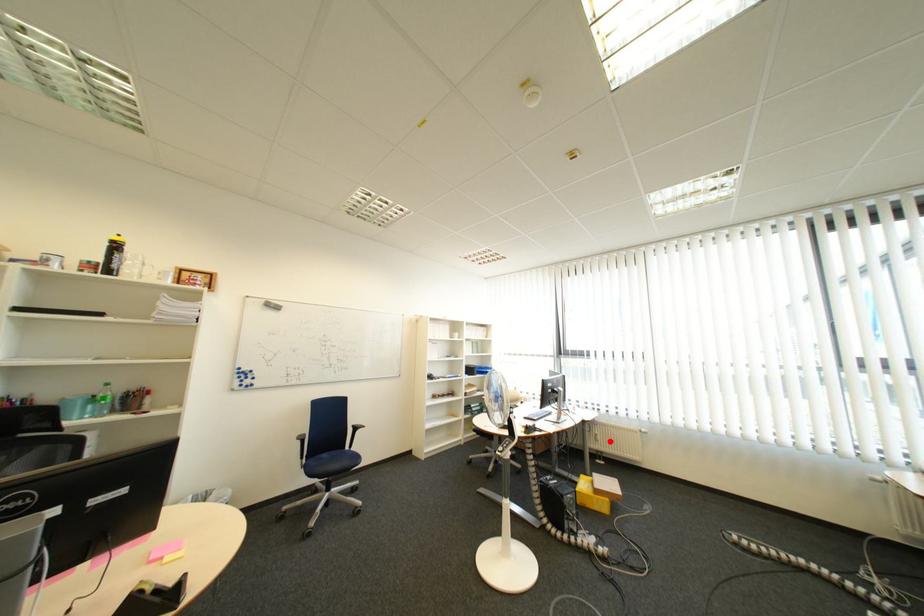
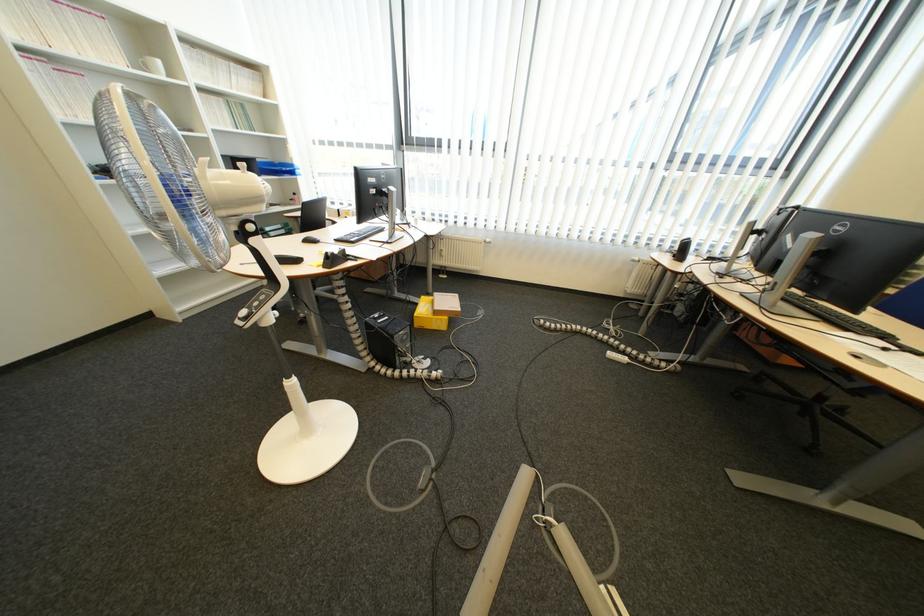
Question: A red point is marked in image1. In image2, is the corresponding 3D point closer to the camera or farther? Reply with the corresponding letter.

Choices:
 (A) The corresponding 3D point is closer.
 (B) The corresponding 3D point is farther.

Answer: (A)